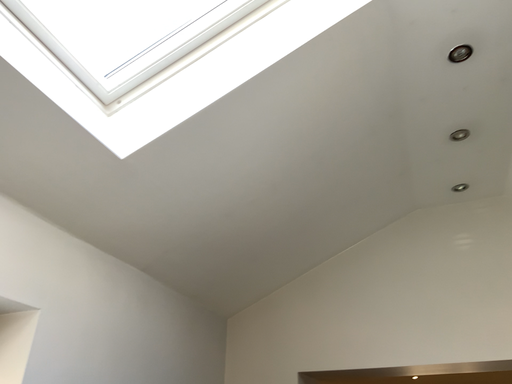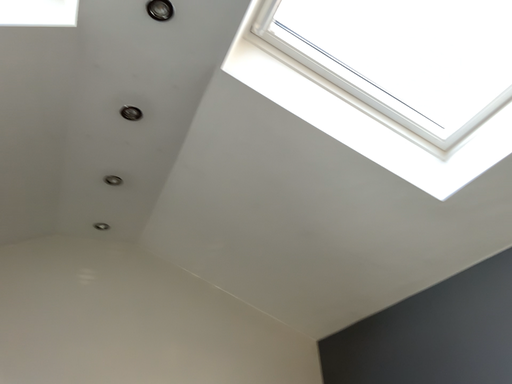
Question: How did the camera likely rotate when shooting the video?

Choices:
 (A) rotated left
 (B) rotated right

Answer: (B)